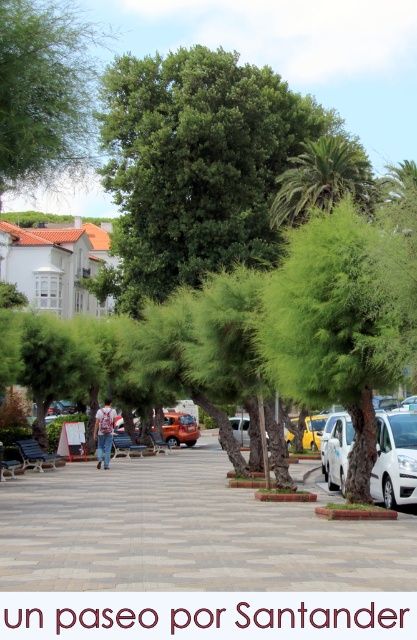
You are standing at the point labeled point (75, 524) and want to walk to the point labeled point (301, 170). Which direction should you face to move towards your destination?

You should face towards the upper left direction because point (301, 170) is located in the upper left relative to point (75, 524).

You are standing at point [303,444] and want to walk to point [314,196]. Given the layout of the park, will you have to walk forward or backward to reach your destination?

You will have to walk forward to reach point [314,196] because it is behind point [303,444] from your current position.